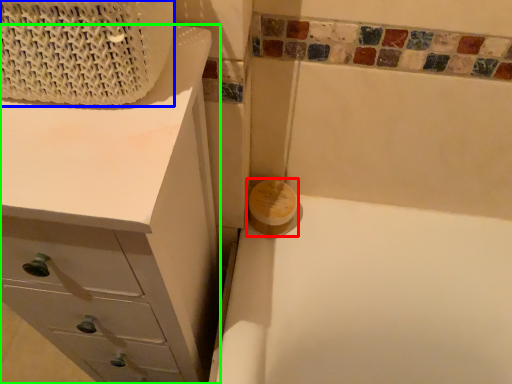
Question: Considering the real-world distances, which object is closest to soap (highlighted by a red box)? basket (highlighted by a blue box) or chest of drawers (highlighted by a green box).

Choices:
 (A) basket
 (B) chest of drawers

Answer: (B)